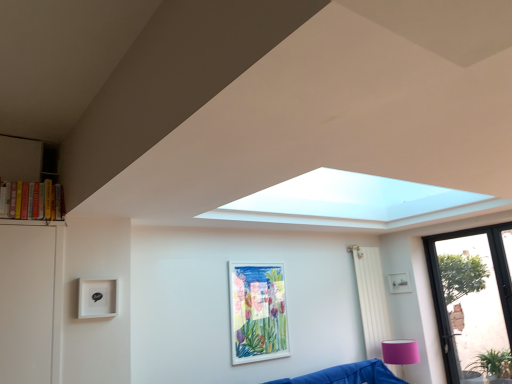
Question: Can you see pink fabric lampshade at lower right touching transparent glass door at lower right?

Choices:
 (A) no
 (B) yes

Answer: (A)

Question: Does pink fabric lampshade at lower right have a lesser width compared to transparent glass door at lower right?

Choices:
 (A) yes
 (B) no

Answer: (B)

Question: From a real-world perspective, is pink fabric lampshade at lower right located higher than transparent glass door at lower right?

Choices:
 (A) no
 (B) yes

Answer: (A)

Question: Is pink fabric lampshade at lower right not near transparent glass door at lower right?

Choices:
 (A) no
 (B) yes

Answer: (A)

Question: Is pink fabric lampshade at lower right bigger than transparent glass door at lower right?

Choices:
 (A) no
 (B) yes

Answer: (A)

Question: Which is correct: transparent glass door at lower right is inside hardcover books at left, or outside of it?

Choices:
 (A) inside
 (B) outside

Answer: (B)

Question: In terms of height, does transparent glass door at lower right look taller or shorter compared to hardcover books at left?

Choices:
 (A) short
 (B) tall

Answer: (B)

Question: From the image's perspective, is transparent glass door at lower right positioned above or below hardcover books at left?

Choices:
 (A) below
 (B) above

Answer: (A)

Question: Is transparent glass door at lower right in front of or behind hardcover books at left in the image?

Choices:
 (A) front
 (B) behind

Answer: (B)

Question: From the image's perspective, relative to matte white picture frame at upper right, positioned as the first picture frame in right-to-left order, is pink fabric lampshade at lower right above or below?

Choices:
 (A) above
 (B) below

Answer: (B)

Question: In terms of width, does pink fabric lampshade at lower right look wider or thinner when compared to matte white picture frame at upper right, positioned as the first picture frame in right-to-left order?

Choices:
 (A) thin
 (B) wide

Answer: (B)

Question: In terms of height, does pink fabric lampshade at lower right look taller or shorter compared to matte white picture frame at upper right, the first picture frame from the back?

Choices:
 (A) tall
 (B) short

Answer: (A)

Question: From a real-world perspective, is pink fabric lampshade at lower right physically located above or below matte white picture frame at upper right, acting as the second picture frame starting from the left?

Choices:
 (A) below
 (B) above

Answer: (A)

Question: Based on their sizes in the image, would you say hardcover books at left is bigger or smaller than pink fabric lampshade at lower right?

Choices:
 (A) small
 (B) big

Answer: (A)

Question: Is hardcover books at left inside the boundaries of pink fabric lampshade at lower right, or outside?

Choices:
 (A) inside
 (B) outside

Answer: (B)